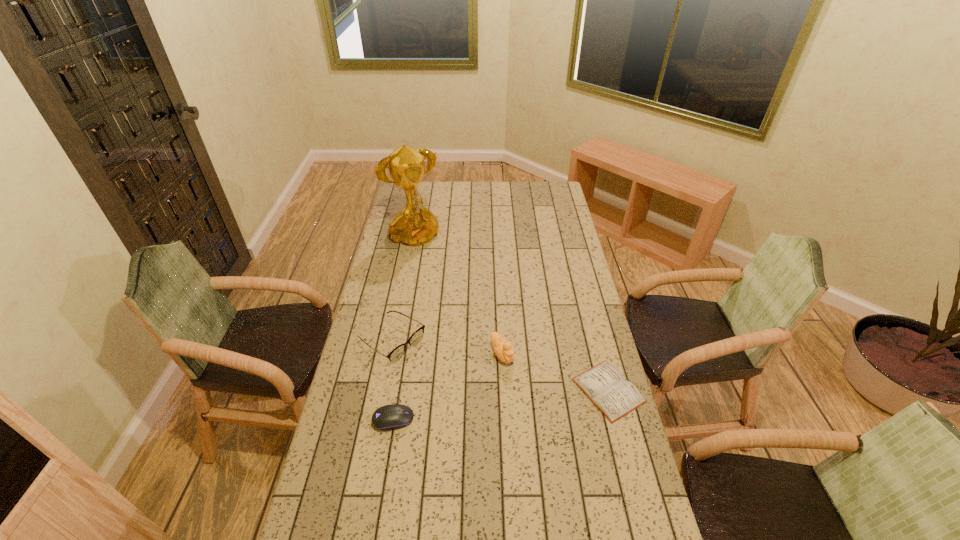
This screenshot has width=960, height=540. I want to click on vacant space located 0.390m on the face of the spectacles, so click(503, 417).

Find the location of a particular element. Image resolution: width=960 pixels, height=540 pixels. vacant space located on the face of the spectacles is located at coordinates (463, 389).

Locate an element on the screen. This screenshot has height=540, width=960. vacant space located 0.210m on the face of the spectacles is located at coordinates (461, 388).

This screenshot has width=960, height=540. I want to click on blank space located on the face of the fourth shortest object, so [526, 392].

Identify the location of vacant space situated on the face of the fourth shortest object. (552, 428).

Image resolution: width=960 pixels, height=540 pixels. I want to click on free space located 0.290m on the face of the fourth shortest object, so click(556, 433).

The width and height of the screenshot is (960, 540). Find the location of `free space located on the front side of the tallest object`. free space located on the front side of the tallest object is located at coordinates (429, 265).

At what (x,y) coordinates should I click in order to perform the action: click on free space located on the front side of the tallest object. Please return your answer as a coordinate pair (x, y). Looking at the image, I should click on (429, 265).

The height and width of the screenshot is (540, 960). I want to click on free region located on the front side of the tallest object, so click(x=441, y=280).

This screenshot has height=540, width=960. Identify the location of computer mouse positioned at the left edge. click(x=393, y=416).